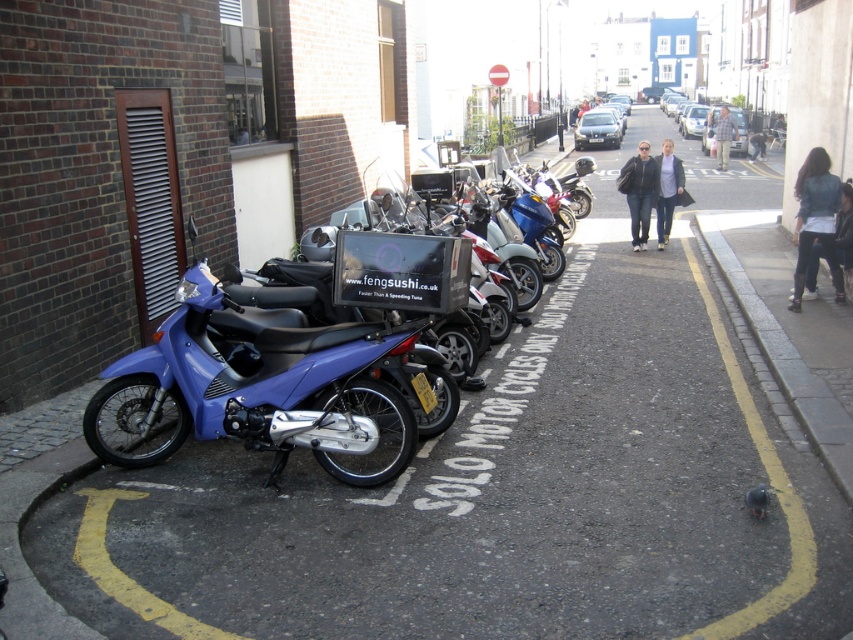
Question: Which point appears closest to the camera in this image?

Choices:
 (A) (320, 454)
 (B) (805, 392)

Answer: (A)

Question: Can you confirm if matte blue motorcycle at left is positioned to the left of gray concrete curb at lower right?

Choices:
 (A) yes
 (B) no

Answer: (A)

Question: Can you confirm if matte blue motorcycle at left is positioned to the left of gray concrete curb at lower right?

Choices:
 (A) yes
 (B) no

Answer: (A)

Question: Does matte blue motorcycle at left come in front of gray concrete curb at lower right?

Choices:
 (A) no
 (B) yes

Answer: (B)

Question: Which point appears farthest from the camera in this image?

Choices:
 (A) (798, 416)
 (B) (427, 301)

Answer: (A)